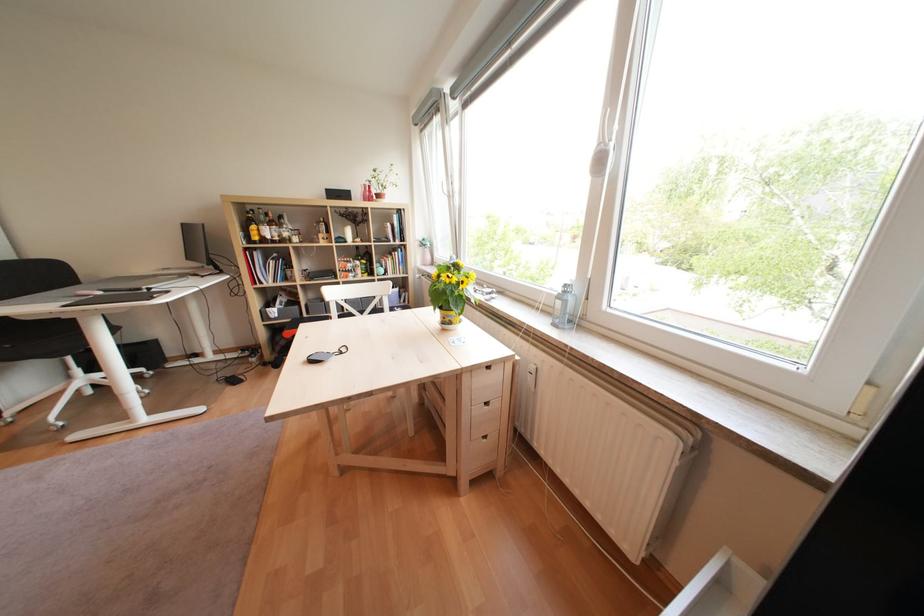
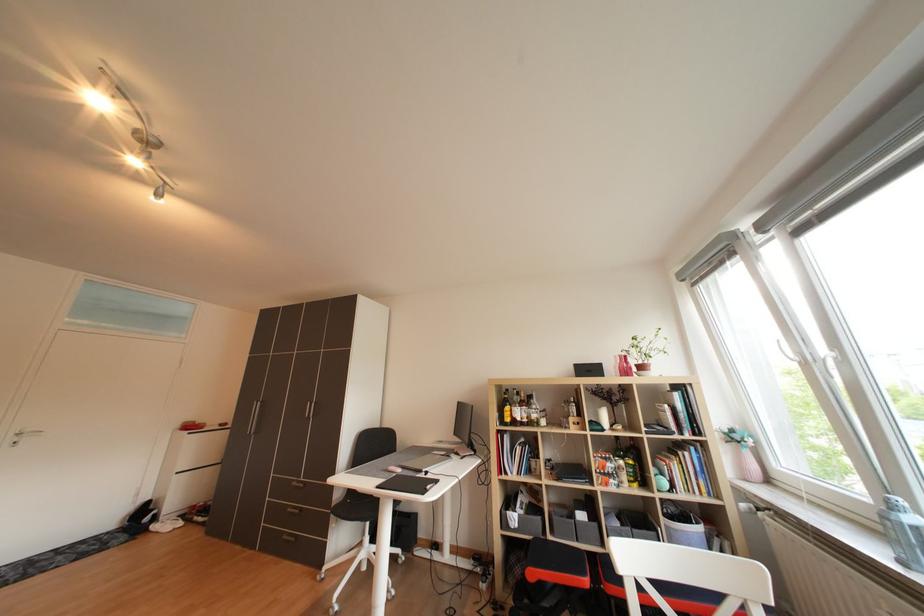
How did the camera likely rotate?

The camera rotated toward left-up.